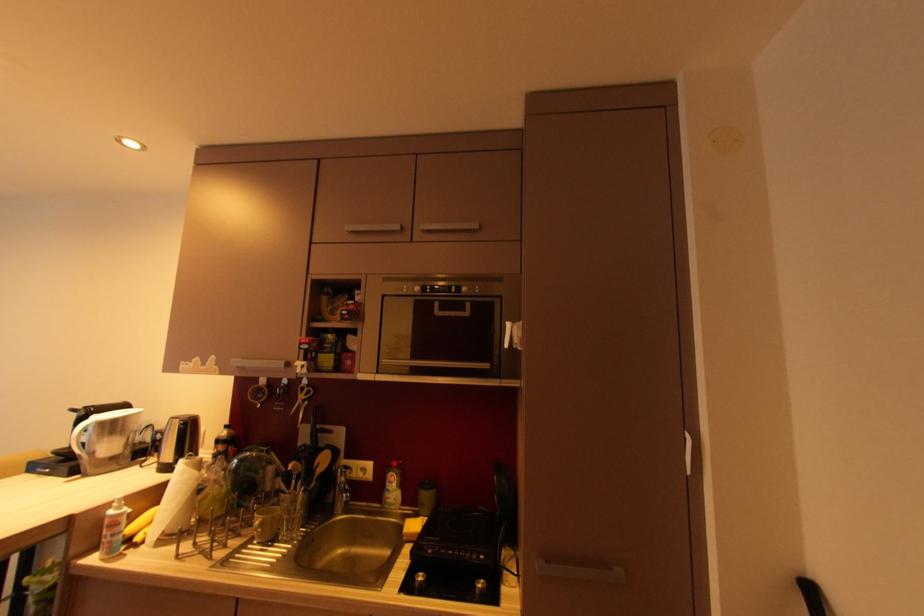
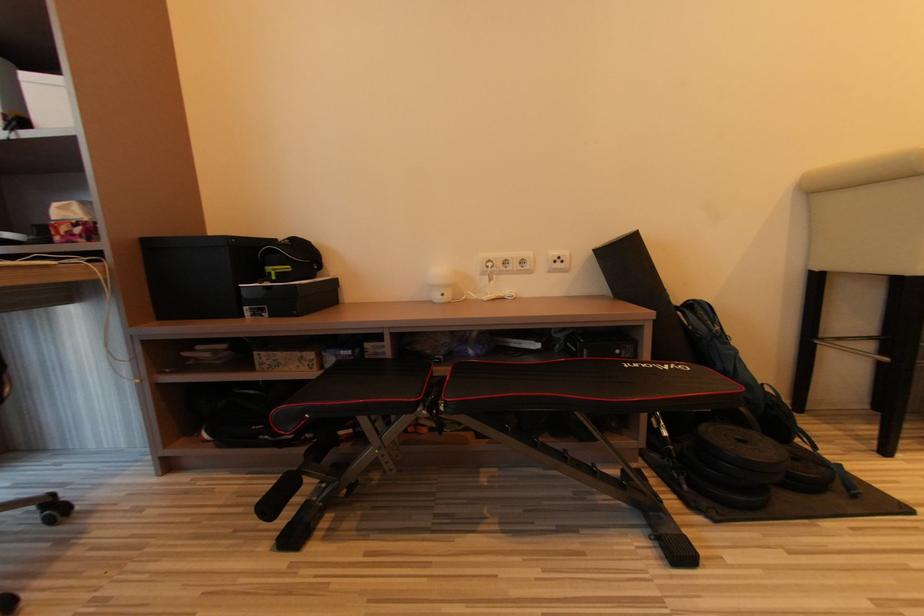
Question: The images are taken continuously from a first-person perspective. In which direction are you moving?

Choices:
 (A) Left
 (B) Right
 (C) Forward
 (D) Backward

Answer: (A)